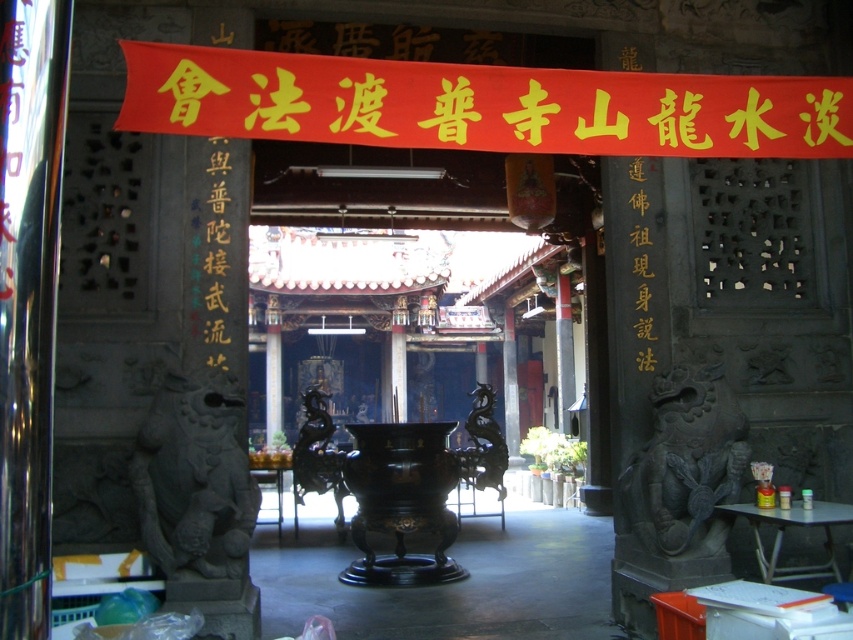
Question: Does red paper banner at upper center have a larger size compared to black stone lion at left?

Choices:
 (A) no
 (B) yes

Answer: (B)

Question: Does red paper banner at upper center appear over black stone lion at right?

Choices:
 (A) no
 (B) yes

Answer: (B)

Question: Does red paper banner at upper center have a greater width compared to black stone lion at left?

Choices:
 (A) no
 (B) yes

Answer: (B)

Question: Which point is farther from the camera taking this photo?

Choices:
 (A) (225, 92)
 (B) (672, 426)
 (C) (206, 534)

Answer: (B)

Question: Which point is closer to the camera?

Choices:
 (A) black stone lion at left
 (B) black stone lion at right
 (C) red paper banner at upper center

Answer: (C)

Question: Which of the following is the closest to the observer?

Choices:
 (A) (631, 548)
 (B) (143, 426)
 (C) (456, 109)

Answer: (C)